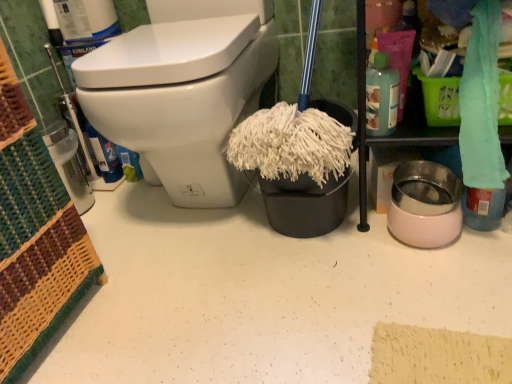
Question: Does teal fabric towel at upper right touch translucent plastic bottle at upper right?

Choices:
 (A) no
 (B) yes

Answer: (B)

Question: Can you confirm if teal fabric towel at upper right is positioned to the right of translucent plastic bottle at upper right?

Choices:
 (A) no
 (B) yes

Answer: (B)

Question: From the image's perspective, is teal fabric towel at upper right above translucent plastic bottle at upper right?

Choices:
 (A) yes
 (B) no

Answer: (B)

Question: Considering the relative sizes of teal fabric towel at upper right and translucent plastic bottle at upper right in the image provided, is teal fabric towel at upper right shorter than translucent plastic bottle at upper right?

Choices:
 (A) no
 (B) yes

Answer: (A)

Question: Would you say translucent plastic bottle at upper right is part of teal fabric towel at upper right's contents?

Choices:
 (A) yes
 (B) no

Answer: (B)

Question: Looking at their shapes, would you say teal fabric towel at upper right is wider or thinner than white glossy toilet at upper left?

Choices:
 (A) thin
 (B) wide

Answer: (A)

Question: Based on their positions, is teal fabric towel at upper right located to the left or right of white glossy toilet at upper left?

Choices:
 (A) left
 (B) right

Answer: (B)

Question: Do you think teal fabric towel at upper right is within white glossy toilet at upper left, or outside of it?

Choices:
 (A) inside
 (B) outside

Answer: (B)

Question: Considering the positions of teal fabric towel at upper right and white glossy toilet at upper left in the image, is teal fabric towel at upper right taller or shorter than white glossy toilet at upper left?

Choices:
 (A) tall
 (B) short

Answer: (B)

Question: Does point (504, 129) appear closer or farther from the camera than point (378, 92)?

Choices:
 (A) closer
 (B) farther

Answer: (A)

Question: Based on their positions, is teal fabric towel at upper right located to the left or right of translucent plastic bottle at upper right?

Choices:
 (A) right
 (B) left

Answer: (A)

Question: Considering their positions, is teal fabric towel at upper right located in front of or behind translucent plastic bottle at upper right?

Choices:
 (A) front
 (B) behind

Answer: (A)

Question: Considering the positions of teal fabric towel at upper right and translucent plastic bottle at upper right in the image, is teal fabric towel at upper right taller or shorter than translucent plastic bottle at upper right?

Choices:
 (A) short
 (B) tall

Answer: (B)

Question: From their relative heights in the image, would you say teal fabric towel at upper right is taller or shorter than white fluffy mop head at center?

Choices:
 (A) short
 (B) tall

Answer: (B)

Question: From the image's perspective, is teal fabric towel at upper right positioned above or below white fluffy mop head at center?

Choices:
 (A) above
 (B) below

Answer: (A)